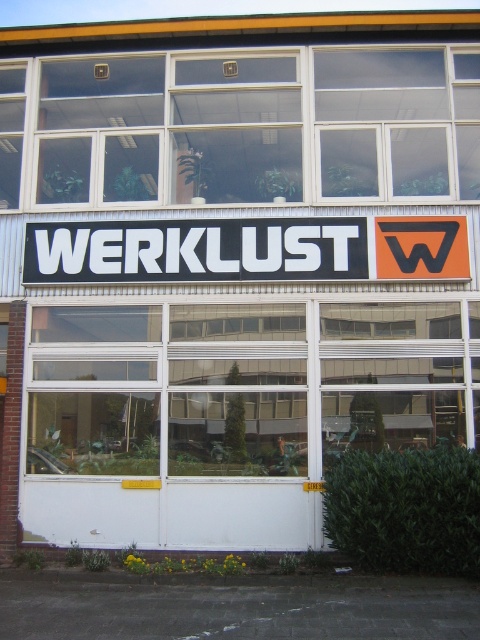
Question: Which of the following is the closest to the observer?

Choices:
 (A) black plastic sign at center
 (B) clear glass window at center

Answer: (A)

Question: In this image, where is clear glass window at center located relative to black plastic sign at center?

Choices:
 (A) left
 (B) right

Answer: (A)

Question: Which point is farther from the camera taking this photo?

Choices:
 (A) (262, 141)
 (B) (239, 250)

Answer: (A)

Question: Is clear glass window at center to the left of black plastic sign at center from the viewer's perspective?

Choices:
 (A) yes
 (B) no

Answer: (A)

Question: Is clear glass window at center smaller than black plastic sign at center?

Choices:
 (A) yes
 (B) no

Answer: (B)